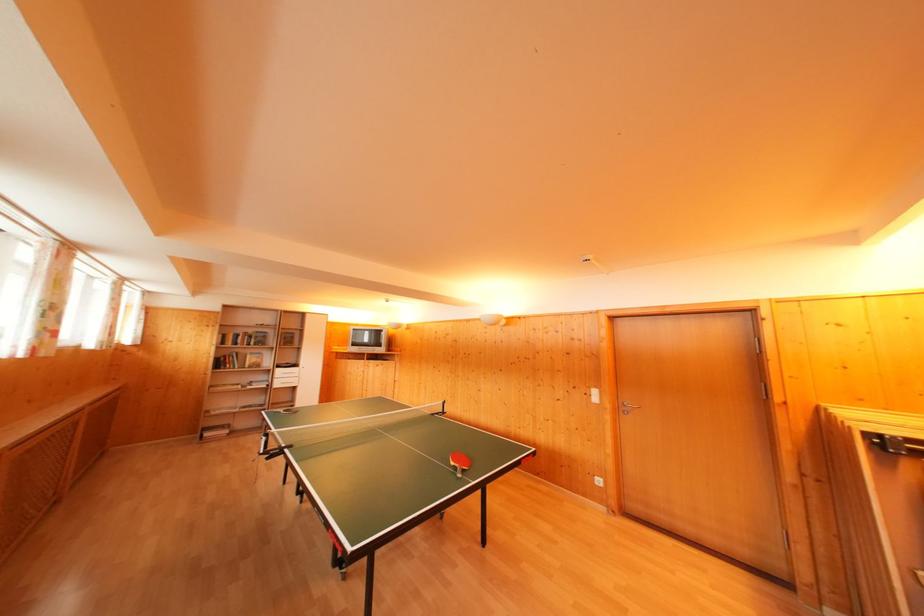
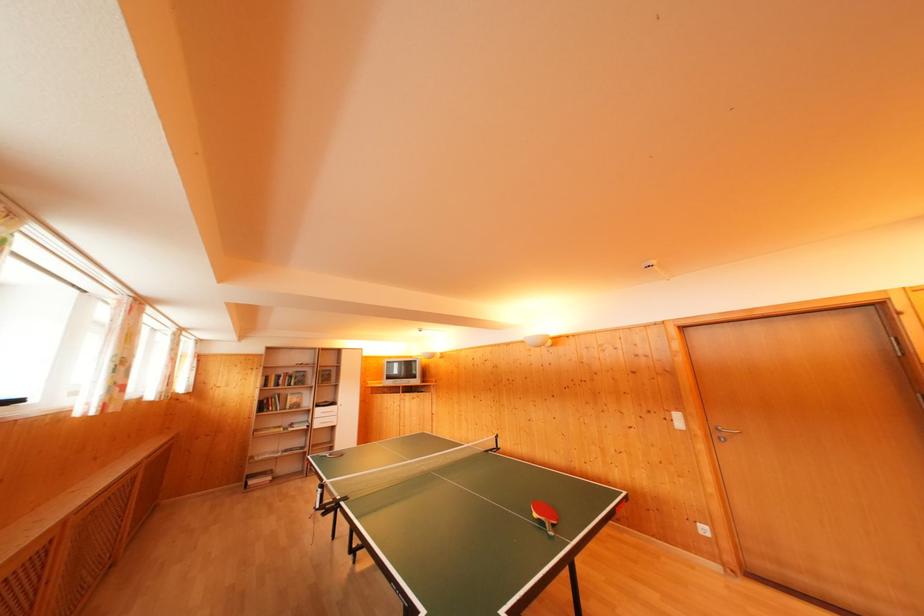
Locate, in the second image, the point that corresponds to point 624,415 in the first image.

(718, 440)